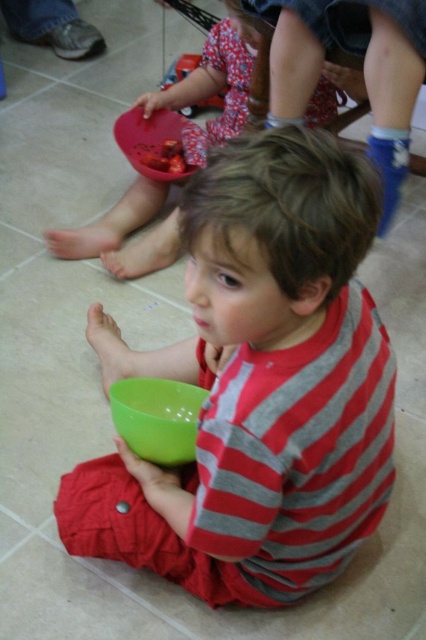
You are taking a photo of two points in the image. The first point is at position point (111, 243) and the second point is at position point (186, 61). Which point will appear larger in your photo?

Point (111, 243) is closer to the camera than point (186, 61), so it will appear larger in the photo.